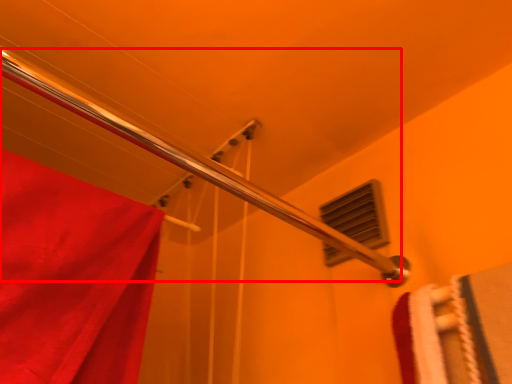
Question: From the image's perspective, where is shower (annotated by the red box) located relative to window?

Choices:
 (A) below
 (B) above

Answer: (B)